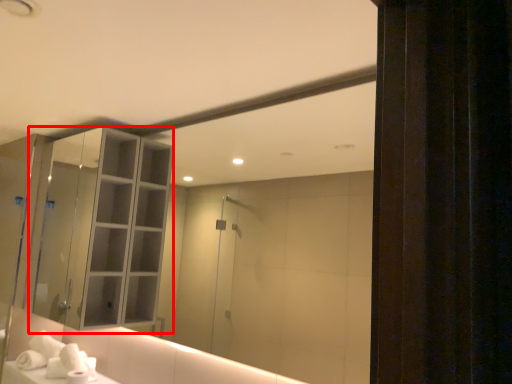
Question: From the image's perspective, what is the correct spatial relationship of cabinetry (annotated by the red box) in relation to hand towel?

Choices:
 (A) below
 (B) above

Answer: (B)